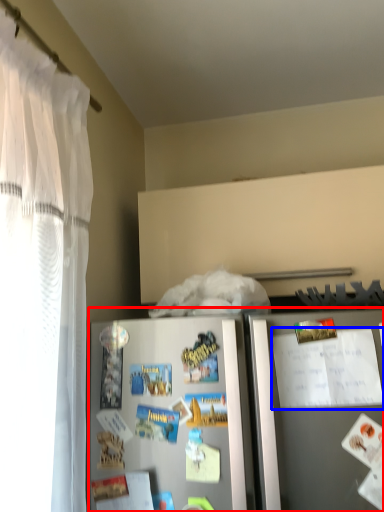
Question: Which point is closer to the camera, refrigerator (highlighted by a red box) or comic book (highlighted by a blue box)?

Choices:
 (A) refrigerator
 (B) comic book

Answer: (A)